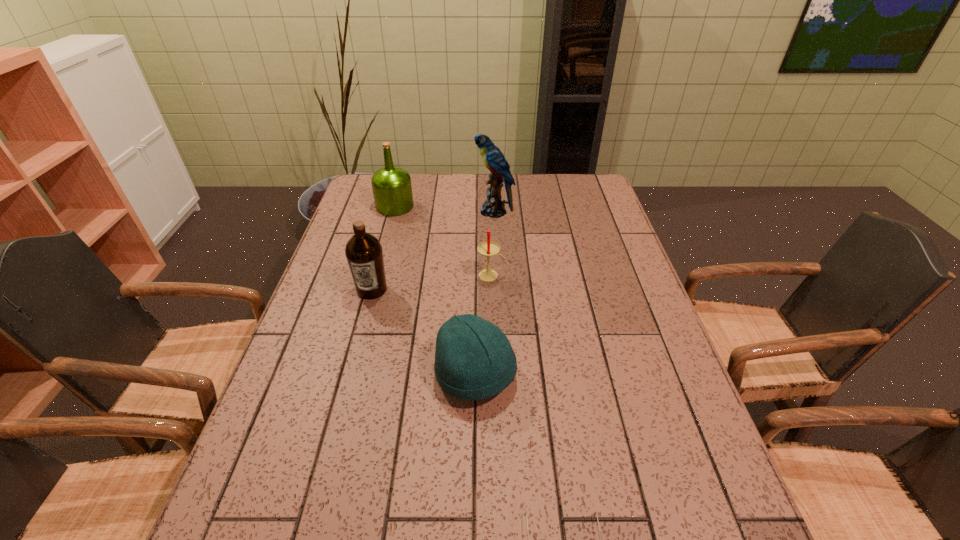
Locate an element on the screen. The image size is (960, 540). parrot is located at coordinates (494, 160).

Find the location of a particular element. The height and width of the screenshot is (540, 960). the farther olive oil is located at coordinates (392, 190).

The height and width of the screenshot is (540, 960). I want to click on the nearer olive oil, so click(363, 251).

At what (x,y) coordinates should I click in order to perform the action: click on candle. Please return your answer as a coordinate pair (x, y). This screenshot has width=960, height=540. Looking at the image, I should click on (488, 249).

I want to click on the fifth farthest object, so click(474, 360).

In order to click on free space located 0.230m on the face of the parrot in this screenshot , I will do `click(409, 211)`.

The width and height of the screenshot is (960, 540). In order to click on vacant space situated on the face of the parrot in this screenshot , I will do `click(363, 211)`.

I want to click on free space located on the face of the parrot, so click(x=458, y=211).

Locate an element on the screen. The width and height of the screenshot is (960, 540). vacant space positioned on the front of the farther olive oil is located at coordinates (388, 234).

I want to click on free space located on the label of the nearer olive oil, so click(x=364, y=320).